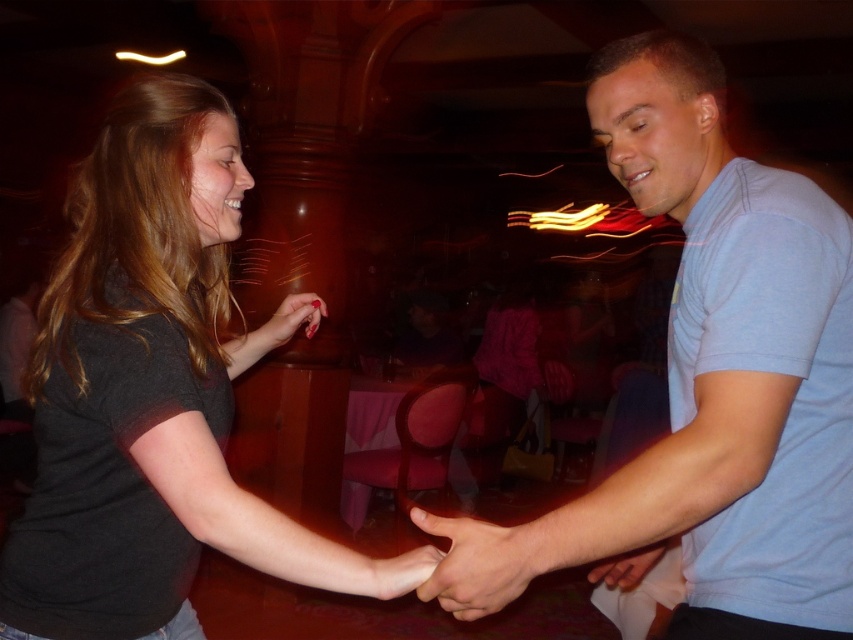
Question: Which point appears farthest from the camera in this image?

Choices:
 (A) (355, 577)
 (B) (527, 570)
 (C) (463, 531)
 (D) (314, 326)

Answer: (D)

Question: Considering the relative positions of dark gray t-shirt at left and smooth skin hand at center in the image provided, where is dark gray t-shirt at left located with respect to smooth skin hand at center?

Choices:
 (A) left
 (B) right

Answer: (A)

Question: Is dark gray t-shirt at left wider than smooth red nail polish at center?

Choices:
 (A) no
 (B) yes

Answer: (B)

Question: Which of the following is the farthest from the observer?

Choices:
 (A) coord(498,596)
 (B) coord(676,84)
 (C) coord(16,550)
 (D) coord(296,314)

Answer: (D)

Question: Does dark gray t-shirt at left have a smaller size compared to smooth red nail polish at center?

Choices:
 (A) yes
 (B) no

Answer: (B)

Question: Estimate the real-world distances between objects in this image. Which object is closer to the smooth skin hand at center?

Choices:
 (A) dark gray t-shirt at left
 (B) light blue cotton shirt at center
 (C) smooth red nail polish at center

Answer: (B)